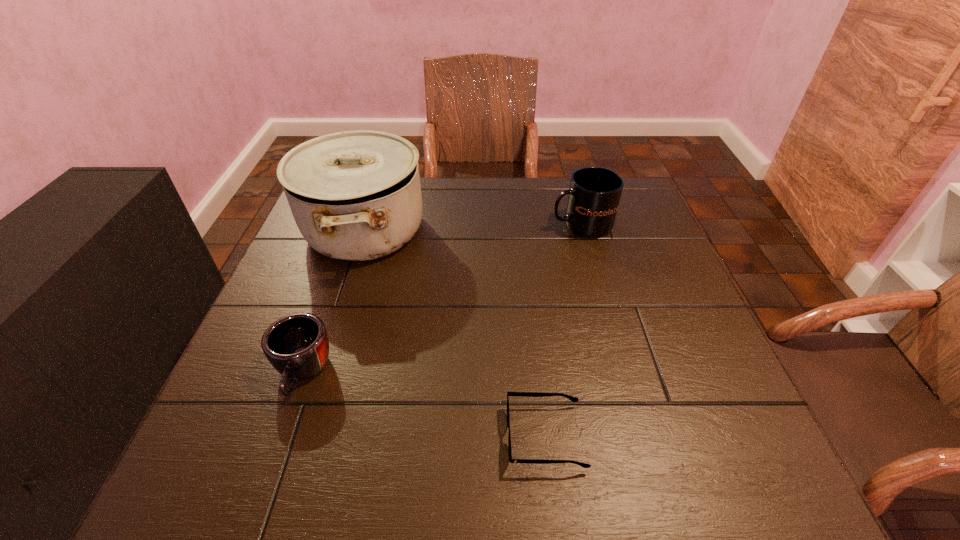
What are the coordinates of `object situated at the right edge` in the screenshot? It's located at (593, 197).

Where is `object situated at the far left corner`? This screenshot has width=960, height=540. object situated at the far left corner is located at coordinates (355, 195).

Locate an element on the screen. The width and height of the screenshot is (960, 540). object situated at the far right corner is located at coordinates (593, 197).

I want to click on free location at the far edge, so click(492, 191).

Where is `free space at the left edge of the desktop`? free space at the left edge of the desktop is located at coordinates (348, 280).

The width and height of the screenshot is (960, 540). What are the coordinates of `free space at the right edge of the desktop` in the screenshot? It's located at (616, 246).

In the image, there is a desktop. Identify the location of vacant space at the far right corner. This screenshot has width=960, height=540. (625, 214).

This screenshot has height=540, width=960. Find the location of `vacant space at the near right corner of the desktop`. vacant space at the near right corner of the desktop is located at coordinates (695, 492).

At what (x,y) coordinates should I click in order to perform the action: click on vacant area between the shortest object and the tallest object. Please return your answer as a coordinate pair (x, y). The image size is (960, 540). Looking at the image, I should click on (455, 333).

Locate an element on the screen. The width and height of the screenshot is (960, 540). free space between the shortest object and the left mug is located at coordinates (424, 404).